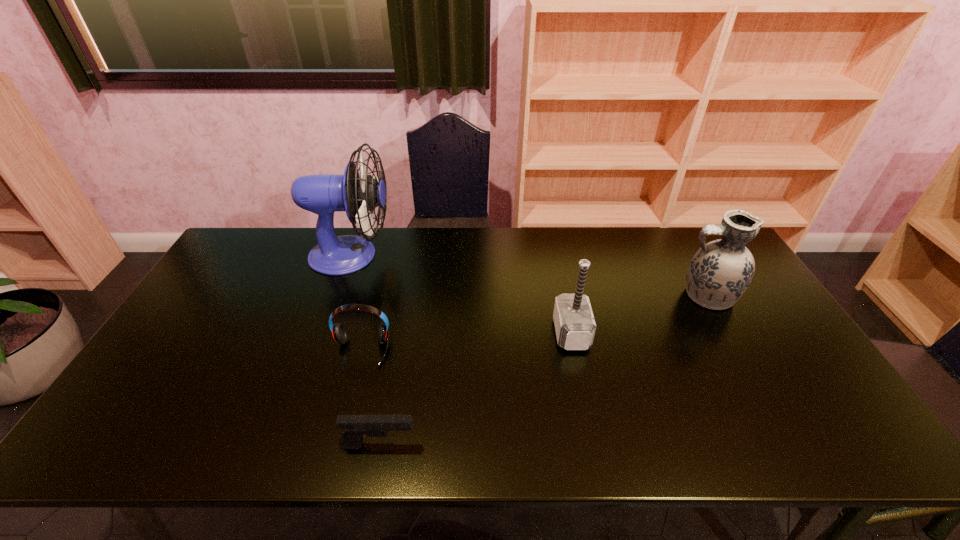
Find the location of a particular element. free region that satisfies the following two spatial constraints: 1. with the handle on the side of the rightmost object; 2. in front of the tallest object where the airflow is directed is located at coordinates (684, 255).

The image size is (960, 540). Find the location of `free location that satisfies the following two spatial constraints: 1. for striking with the head of the hammer; 2. with the microphone attached to the side of the fourth tallest object`. free location that satisfies the following two spatial constraints: 1. for striking with the head of the hammer; 2. with the microphone attached to the side of the fourth tallest object is located at coordinates (575, 351).